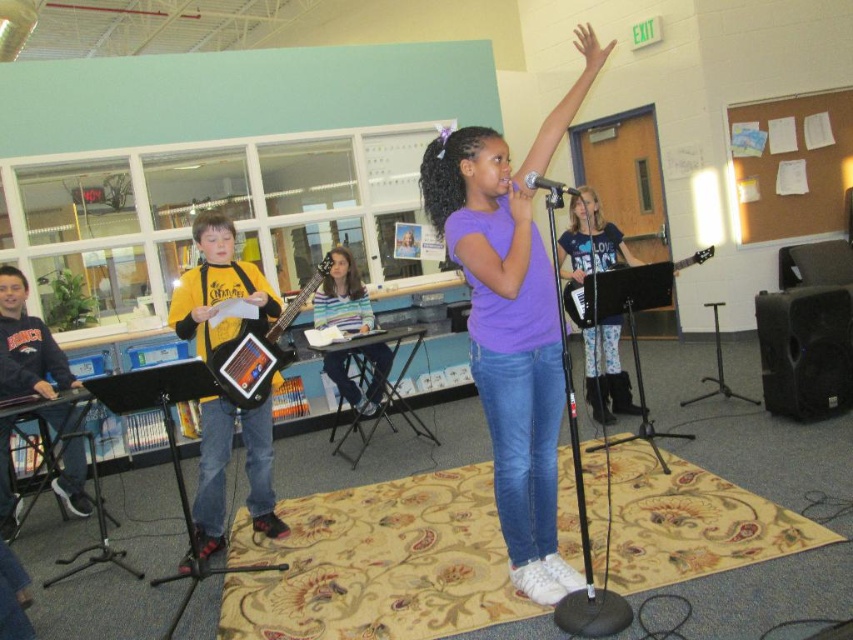
Question: Which of the following is the farthest from the observer?

Choices:
 (A) tap(258, 326)
 (B) tap(476, 355)
 (C) tap(74, 396)

Answer: (C)

Question: In this image, where is yellow jersey at left located relative to striped fabric shirt at center?

Choices:
 (A) left
 (B) right

Answer: (A)

Question: Can you confirm if black plastic electric guitar at center is thinner than black metallic microphone at center?

Choices:
 (A) no
 (B) yes

Answer: (A)

Question: Considering the real-world distances, which object is closest to the yellow jersey at left?

Choices:
 (A) striped fabric shirt at center
 (B) black metallic microphone at center
 (C) wooden electric guitar at center
 (D) brushed metal keyboard at left

Answer: (C)

Question: Is purple matte shirt at center to the right of black plastic electric guitar at center from the viewer's perspective?

Choices:
 (A) yes
 (B) no

Answer: (B)

Question: Which of the following is the farthest from the observer?

Choices:
 (A) (215, 376)
 (B) (215, 481)
 (C) (532, 179)
 (D) (582, 316)

Answer: (D)